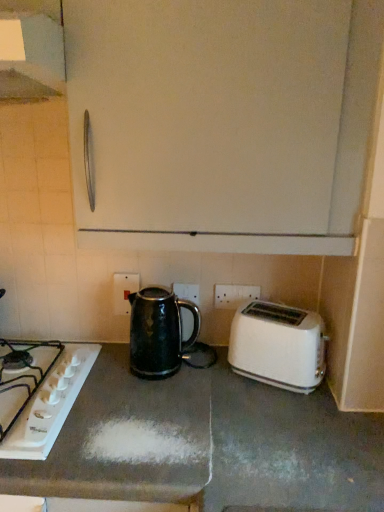
Looking at this image, measure the distance between black glossy kettle at center and camera.

A distance of 1.16 meters exists between black glossy kettle at center and camera.

I want to click on metallic silver exhaust hood at upper left, so click(31, 50).

Measure the distance between point (x=13, y=42) and camera.

Point (x=13, y=42) and camera are 28.27 inches apart from each other.

What is the approximate height of white plastic electric outlet at center, which is counted as the 2th electric outlet, starting from the right?

5.87 inches.

Locate an element on the screen. white plastic electric outlet at center, which is counted as the 2th electric outlet, starting from the right is located at coordinates (124, 291).

This screenshot has height=512, width=384. What are the coordinates of `white glossy gas stove at lower left` in the screenshot? It's located at (50, 405).

What do you see at coordinates (278, 346) in the screenshot?
I see `white plastic toaster at lower right` at bounding box center [278, 346].

The width and height of the screenshot is (384, 512). In order to click on black glossy kettle at center in this screenshot , I will do `click(159, 332)`.

Considering the positions of point (17, 93) and point (241, 293), is point (17, 93) closer or farther from the camera than point (241, 293)?

Point (17, 93) is positioned closer to the camera compared to point (241, 293).

Considering the sizes of objects metallic silver exhaust hood at upper left and white plastic electric outlet at center, positioned as the first electric outlet in right-to-left order, in the image provided, who is thinner, metallic silver exhaust hood at upper left or white plastic electric outlet at center, positioned as the first electric outlet in right-to-left order,?

Thinner between the two is white plastic electric outlet at center, positioned as the first electric outlet in right-to-left order.

Does metallic silver exhaust hood at upper left have a greater height compared to white plastic electric outlet at center, the second electric outlet from the left?

Yes.

Is white plastic toaster at lower right far from white plastic electric outlet at center, positioned as the first electric outlet in right-to-left order?

No, white plastic toaster at lower right is not far away from white plastic electric outlet at center, positioned as the first electric outlet in right-to-left order.

Could you tell me if white plastic toaster at lower right is turned towards white plastic electric outlet at center, positioned as the first electric outlet in right-to-left order?

No, white plastic toaster at lower right is not facing towards white plastic electric outlet at center, positioned as the first electric outlet in right-to-left order.

Where is `the 2nd electric outlet above the white plastic toaster at lower right (from a real-world perspective)`? the 2nd electric outlet above the white plastic toaster at lower right (from a real-world perspective) is located at coordinates (234, 295).

Is white plastic toaster at lower right outside of white plastic electric outlet at center, positioned as the first electric outlet in right-to-left order?

Yes, white plastic toaster at lower right is outside of white plastic electric outlet at center, positioned as the first electric outlet in right-to-left order.

Is black glossy kettle at center behind metallic silver exhaust hood at upper left?

Yes.

Which of these two, black glossy kettle at center or metallic silver exhaust hood at upper left, stands taller?

Standing taller between the two is black glossy kettle at center.

From the image's perspective, which object appears higher, black glossy kettle at center or metallic silver exhaust hood at upper left?

metallic silver exhaust hood at upper left appears higher in the image.

Between white plastic electric outlet at center, the first electric outlet from the left, and black glossy kettle at center, which one is positioned behind?

white plastic electric outlet at center, the first electric outlet from the left, is further from the camera.

Between white plastic electric outlet at center, the first electric outlet from the left, and black glossy kettle at center, which one has smaller size?

white plastic electric outlet at center, the first electric outlet from the left.

From a real-world perspective, which object stands above the other?

In real-world perspective, white plastic electric outlet at center, the first electric outlet from the left, is above.

Is white plastic electric outlet at center, the first electric outlet from the left, positioned with its back to black glossy kettle at center?

That's not correct — white plastic electric outlet at center, the first electric outlet from the left, is not looking away from black glossy kettle at center.

Which of these two, white plastic electric outlet at center, positioned as the first electric outlet in right-to-left order, or white plastic electric outlet at center, which is counted as the 2th electric outlet, starting from the right, is bigger?

white plastic electric outlet at center, which is counted as the 2th electric outlet, starting from the right.

How many degrees apart are the facing directions of white plastic electric outlet at center, positioned as the first electric outlet in right-to-left order, and white plastic electric outlet at center, the first electric outlet from the left?

There is a 2.85-degree angle between the facing directions of white plastic electric outlet at center, positioned as the first electric outlet in right-to-left order, and white plastic electric outlet at center, the first electric outlet from the left.

Where is `electric outlet located above the white plastic electric outlet at center, the second electric outlet from the left (from the image's perspective)`? This screenshot has height=512, width=384. electric outlet located above the white plastic electric outlet at center, the second electric outlet from the left (from the image's perspective) is located at coordinates (124, 291).

From a real-world perspective, is white plastic electric outlet at center, positioned as the first electric outlet in right-to-left order, physically above white plastic electric outlet at center, which is counted as the 2th electric outlet, starting from the right?

Yes, from a real-world perspective, white plastic electric outlet at center, positioned as the first electric outlet in right-to-left order, is above white plastic electric outlet at center, which is counted as the 2th electric outlet, starting from the right.

How many degrees apart are the facing directions of black glossy kettle at center and white glossy gas stove at lower left?

There is a 0.207-degree angle between the facing directions of black glossy kettle at center and white glossy gas stove at lower left.

Can you confirm if black glossy kettle at center is thinner than white glossy gas stove at lower left?

Yes, black glossy kettle at center is thinner than white glossy gas stove at lower left.

How much distance is there between black glossy kettle at center and white glossy gas stove at lower left?

A distance of 9.70 inches exists between black glossy kettle at center and white glossy gas stove at lower left.

Is white glossy gas stove at lower left located within black glossy kettle at center?

No, black glossy kettle at center does not contain white glossy gas stove at lower left.

Identify the location of exhaust hood that appears in front of the white plastic toaster at lower right. The height and width of the screenshot is (512, 384). (31, 50).

Which object is closer to the camera, white plastic toaster at lower right or metallic silver exhaust hood at upper left?

metallic silver exhaust hood at upper left is more forward.

In the scene shown: What's the angular difference between white plastic toaster at lower right and metallic silver exhaust hood at upper left's facing directions?

white plastic toaster at lower right and metallic silver exhaust hood at upper left are facing 28.2 degrees away from each other.

Between white plastic toaster at lower right and metallic silver exhaust hood at upper left, which one has smaller size?

Smaller between the two is white plastic toaster at lower right.

This screenshot has width=384, height=512. I want to click on the 1st electric outlet behind the metallic silver exhaust hood at upper left, starting your count from the anchor, so click(x=234, y=295).

This screenshot has width=384, height=512. In the image, there is a white plastic electric outlet at center, the second electric outlet from the left. In order to click on toaster below it (from a real-world perspective) in this screenshot , I will do `click(278, 346)`.

Looking at the image, which one is located closer to white plastic electric outlet at center, the second electric outlet from the left, white plastic electric outlet at center, the first electric outlet from the left, or black glossy kettle at center?

black glossy kettle at center.

From the image, which object appears to be farther from black glossy kettle at center, white plastic toaster at lower right or white plastic electric outlet at center, the second electric outlet from the left?

Among the two, white plastic toaster at lower right is located further to black glossy kettle at center.

When comparing their distances from white plastic electric outlet at center, positioned as the first electric outlet in right-to-left order, does white plastic toaster at lower right or white glossy gas stove at lower left seem further?

white glossy gas stove at lower left lies further to white plastic electric outlet at center, positioned as the first electric outlet in right-to-left order, than the other object.

Estimate the real-world distances between objects in this image. Which object is closer to white plastic electric outlet at center, positioned as the first electric outlet in right-to-left order, black glossy kettle at center or metallic silver exhaust hood at upper left?

Among the two, black glossy kettle at center is located nearer to white plastic electric outlet at center, positioned as the first electric outlet in right-to-left order.

Based on their spatial positions, is black glossy kettle at center or white plastic electric outlet at center, the second electric outlet from the left, closer to metallic silver exhaust hood at upper left?

Based on the image, black glossy kettle at center appears to be nearer to metallic silver exhaust hood at upper left.

Which object lies nearer to the anchor point white glossy gas stove at lower left, white plastic electric outlet at center, the first electric outlet from the left, or black glossy kettle at center?

black glossy kettle at center is positioned closer to the anchor white glossy gas stove at lower left.

From the image, which object appears to be nearer to black glossy kettle at center, white plastic electric outlet at center, positioned as the first electric outlet in right-to-left order, or metallic silver exhaust hood at upper left?

white plastic electric outlet at center, positioned as the first electric outlet in right-to-left order, is positioned closer to the anchor black glossy kettle at center.

From the image, which object appears to be farther from black glossy kettle at center, white glossy gas stove at lower left or white plastic toaster at lower right?

white plastic toaster at lower right is positioned further to the anchor black glossy kettle at center.

The image size is (384, 512). I want to click on electric outlet located between black glossy kettle at center and white plastic toaster at lower right in the left-right direction, so click(234, 295).

Image resolution: width=384 pixels, height=512 pixels. Find the location of `electric outlet between white glossy gas stove at lower left and white plastic electric outlet at center, the second electric outlet from the left, in the horizontal direction`. electric outlet between white glossy gas stove at lower left and white plastic electric outlet at center, the second electric outlet from the left, in the horizontal direction is located at coordinates (124, 291).

At what (x,y) coordinates should I click in order to perform the action: click on kettle positioned between white glossy gas stove at lower left and white plastic electric outlet at center, which is counted as the 2th electric outlet, starting from the right, from near to far. Please return your answer as a coordinate pair (x, y). This screenshot has width=384, height=512. Looking at the image, I should click on (159, 332).

Find the location of a particular element. toaster between metallic silver exhaust hood at upper left and white glossy gas stove at lower left in the up-down direction is located at coordinates [x=278, y=346].